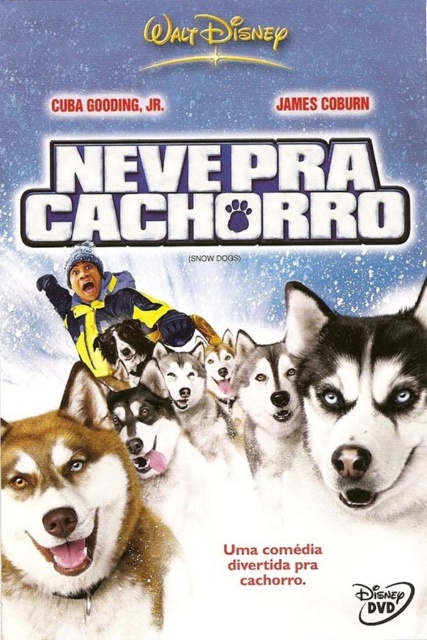
Question: Which object is farther from the camera taking this photo?

Choices:
 (A) shiny brown fur at center
 (B) sleek fur husky at center

Answer: (B)

Question: Is shiny brown fur at center positioned behind sleek fur husky at center?

Choices:
 (A) no
 (B) yes

Answer: (A)

Question: Is shiny brown fur at center smaller than sleek fur husky at center?

Choices:
 (A) yes
 (B) no

Answer: (B)

Question: Which object appears closest to the camera in this image?

Choices:
 (A) sleek fur husky at center
 (B) shiny brown fur at center

Answer: (B)

Question: Is shiny brown fur at center positioned before sleek fur husky at center?

Choices:
 (A) no
 (B) yes

Answer: (B)